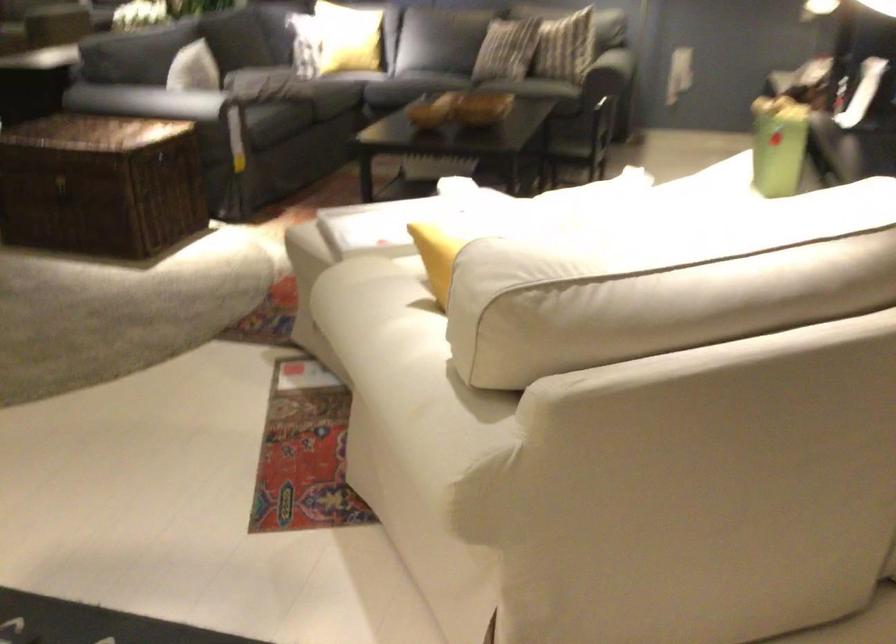
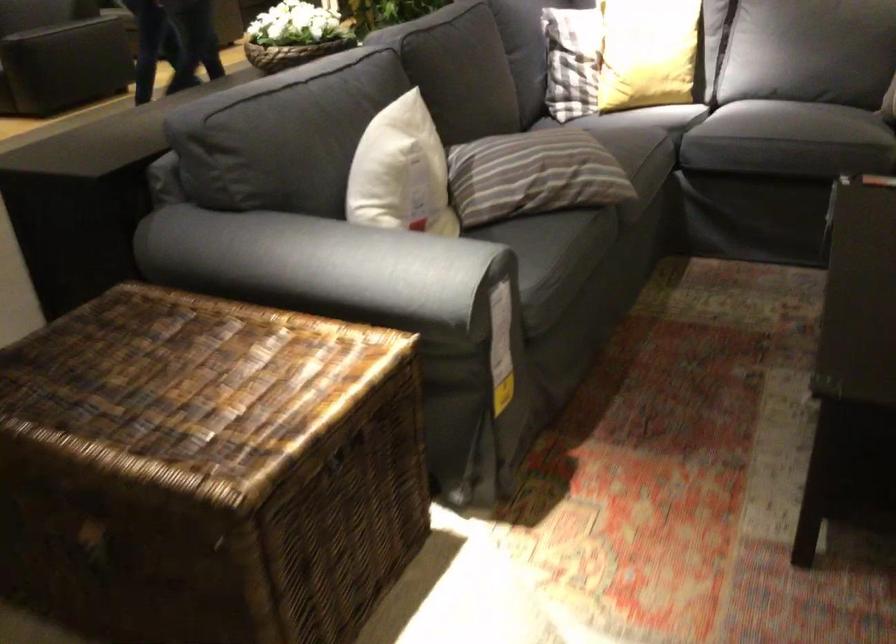
Locate, in the second image, the point that corresponds to [264,77] in the first image.

(533, 174)